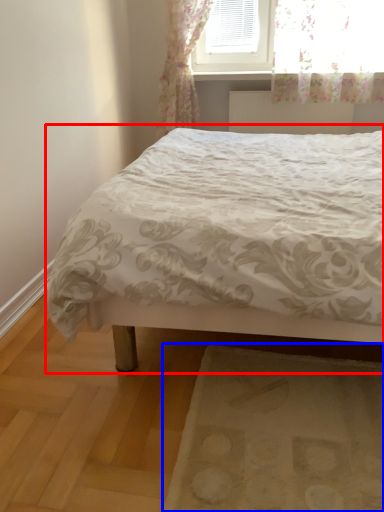
Question: Which object is closer to the camera taking this photo, bed (highlighted by a red box) or mat (highlighted by a blue box)?

Choices:
 (A) bed
 (B) mat

Answer: (A)